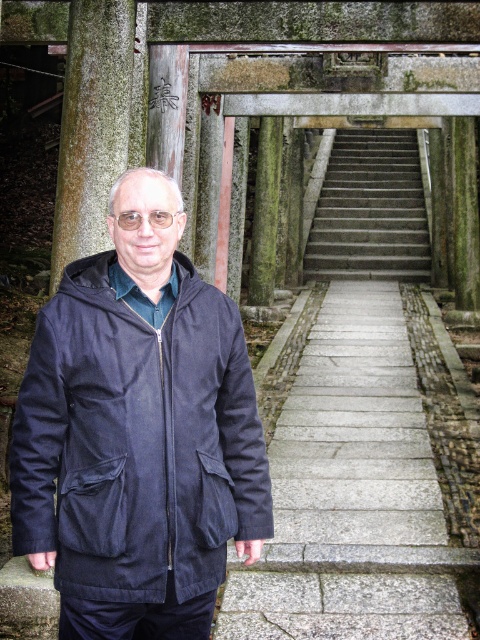
Question: Considering the real-world distances, which object is farthest from the smooth gray stone pillar at center?

Choices:
 (A) green mossy stone pillar at center
 (B) gray concrete stairs at center
 (C) navy blue fabric jacket at center

Answer: (B)

Question: Is navy blue fabric jacket at center positioned behind green mossy stone pillar at center?

Choices:
 (A) yes
 (B) no

Answer: (B)

Question: Is gray concrete stairs at center smaller than green mossy stone pillar at center?

Choices:
 (A) no
 (B) yes

Answer: (A)

Question: Is gray concrete stairs at center closer to the viewer compared to green mossy stone pillar at center?

Choices:
 (A) no
 (B) yes

Answer: (A)

Question: Which point appears closest to the camera in this image?

Choices:
 (A) (320, 216)
 (B) (272, 284)

Answer: (B)

Question: Based on their relative distances, which object is nearer to the gray concrete stairs at center?

Choices:
 (A) green mossy stone pillar at center
 (B) navy blue fabric jacket at center

Answer: (A)